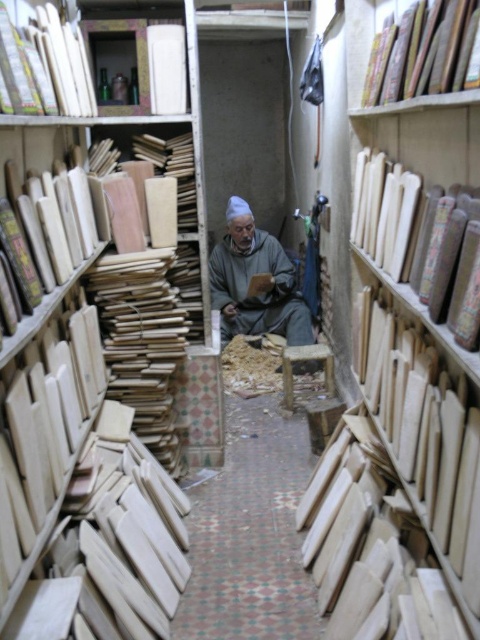
Question: Which point is closer to the camera taking this photo?

Choices:
 (A) (380, 198)
 (B) (242, 275)
 (C) (359, 346)

Answer: (A)

Question: Can you confirm if smooth light brown wood at center is bigger than wooden stool at center?

Choices:
 (A) no
 (B) yes

Answer: (B)

Question: Which object appears closest to the camera in this image?

Choices:
 (A) wooden plank at right
 (B) smooth wood plank at upper left
 (C) light brown wood bookshelf at left

Answer: (A)

Question: Which object is closer to the camera taking this photo?

Choices:
 (A) wooden plank at right
 (B) smooth light brown wood at center
 (C) wooden boards at right

Answer: (C)

Question: Is light brown wood bookshelf at left below gray woolen robe at center?

Choices:
 (A) no
 (B) yes

Answer: (B)

Question: Can you confirm if wooden plank at right is wider than wooden stool at center?

Choices:
 (A) no
 (B) yes

Answer: (A)